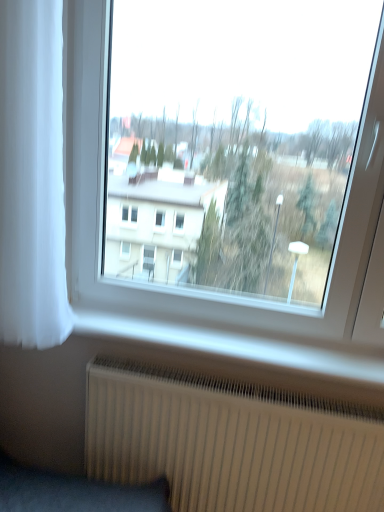
Question: Is white ribbed radiator at lower center wider or thinner than transparent glass window at center?

Choices:
 (A) wide
 (B) thin

Answer: (B)

Question: From a real-world perspective, is white ribbed radiator at lower center positioned above or below transparent glass window at center?

Choices:
 (A) above
 (B) below

Answer: (B)

Question: Which object is positioned closest to the white ribbed radiator at lower center?

Choices:
 (A) white sheer curtain at left
 (B) transparent glass window at center

Answer: (A)

Question: Which object is positioned farthest from the transparent glass window at center?

Choices:
 (A) white ribbed radiator at lower center
 (B) white sheer curtain at left

Answer: (B)